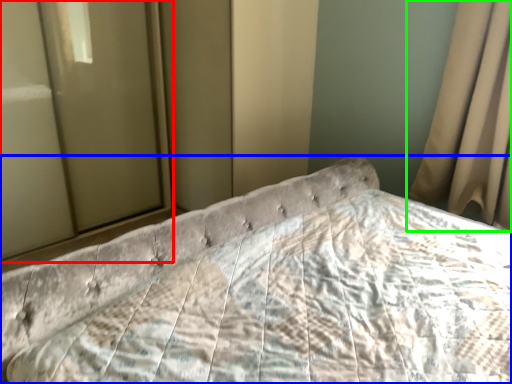
Question: Which is nearer to the glass door (highlighted by a red box)? bed (highlighted by a blue box) or curtain (highlighted by a green box).

Choices:
 (A) bed
 (B) curtain

Answer: (A)